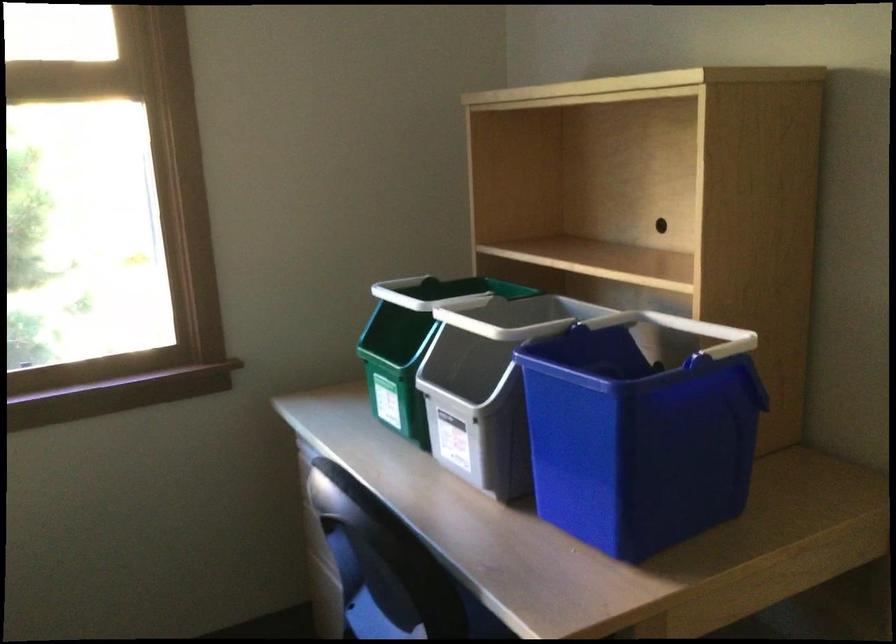
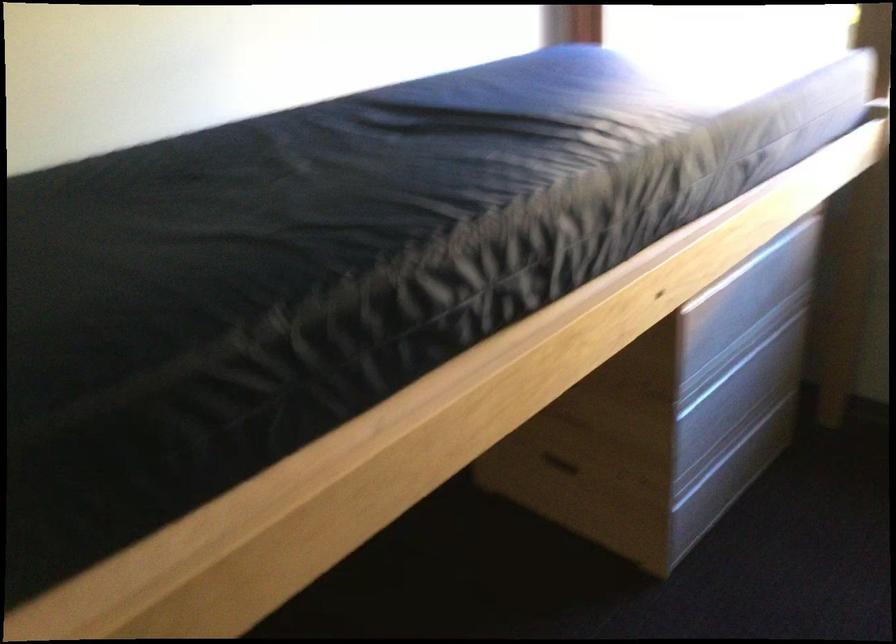
First-person continuous shooting, in which direction is the camera rotating?

The camera's rotation is toward left-down.